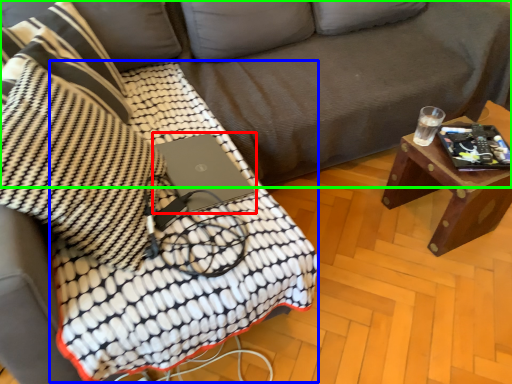
Question: Which object is the closest to the laptop (highlighted by a red box)? Choose among these: blanket (highlighted by a blue box) or studio couch (highlighted by a green box).

Choices:
 (A) blanket
 (B) studio couch

Answer: (A)